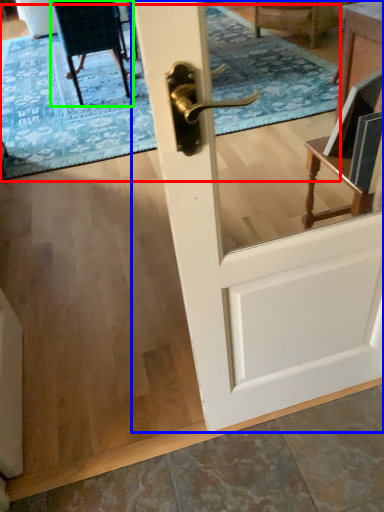
Question: Which object is positioned farthest from doormat (highlighted by a red box)? Select from door (highlighted by a blue box) and chair (highlighted by a green box).

Choices:
 (A) door
 (B) chair

Answer: (A)